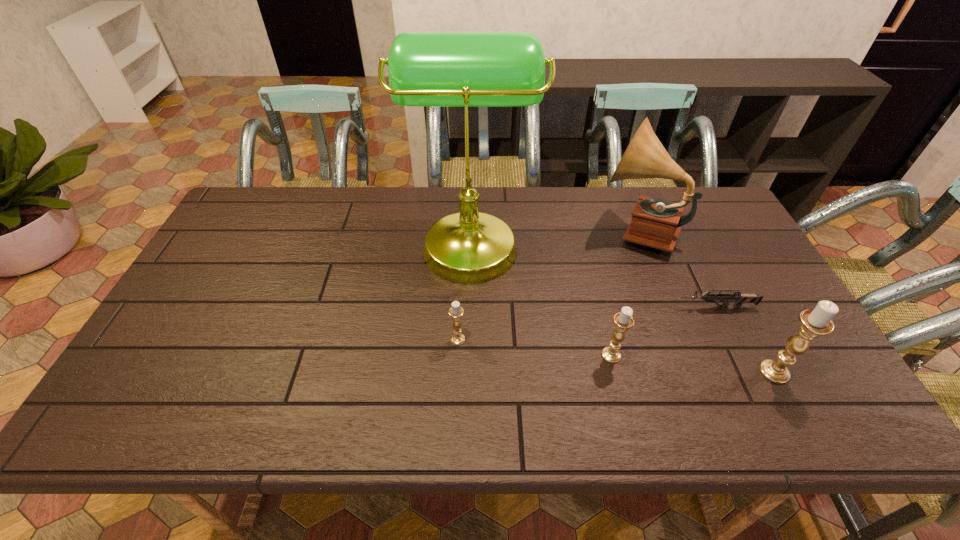
Where is `vacant region that satisfies the following two spatial constraints: 1. on the desk next to the lamp; 2. on the right side of the tallest candle holder`? Image resolution: width=960 pixels, height=540 pixels. vacant region that satisfies the following two spatial constraints: 1. on the desk next to the lamp; 2. on the right side of the tallest candle holder is located at coordinates (468, 372).